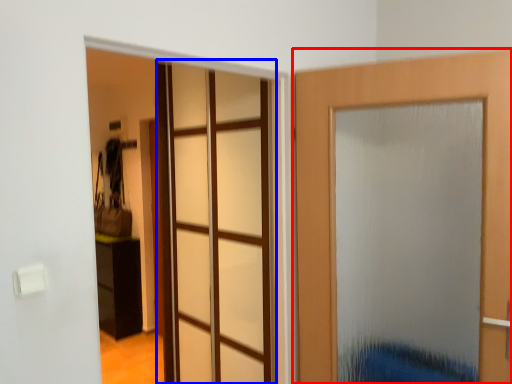
Question: Which object appears farthest to the camera in this image, door (highlighted by a red box) or glass door (highlighted by a blue box)?

Choices:
 (A) door
 (B) glass door

Answer: (B)